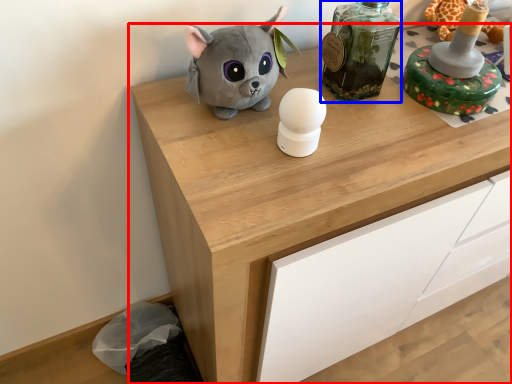
Question: Among these objects, which one is farthest to the camera, chest of drawers (highlighted by a red box) or bottle (highlighted by a blue box)?

Choices:
 (A) chest of drawers
 (B) bottle

Answer: (B)